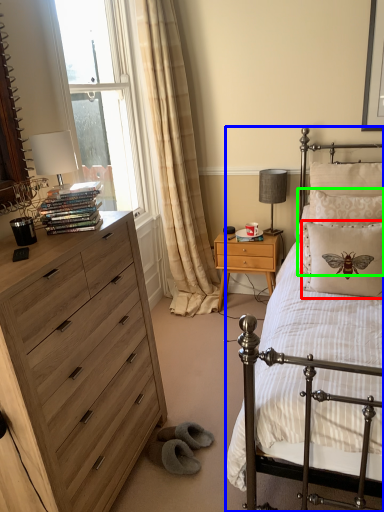
Question: Estimate the real-world distances between objects in this image. Which object is closer to pillow (highlighted by a red box), bed (highlighted by a blue box) or pillow (highlighted by a green box)?

Choices:
 (A) bed
 (B) pillow

Answer: (B)